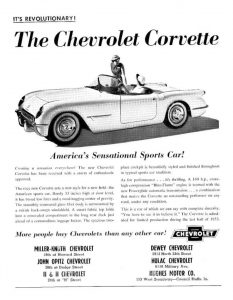
This screenshot has width=233, height=300. What are the coordinates of `door` in the screenshot? It's located at (139, 108).